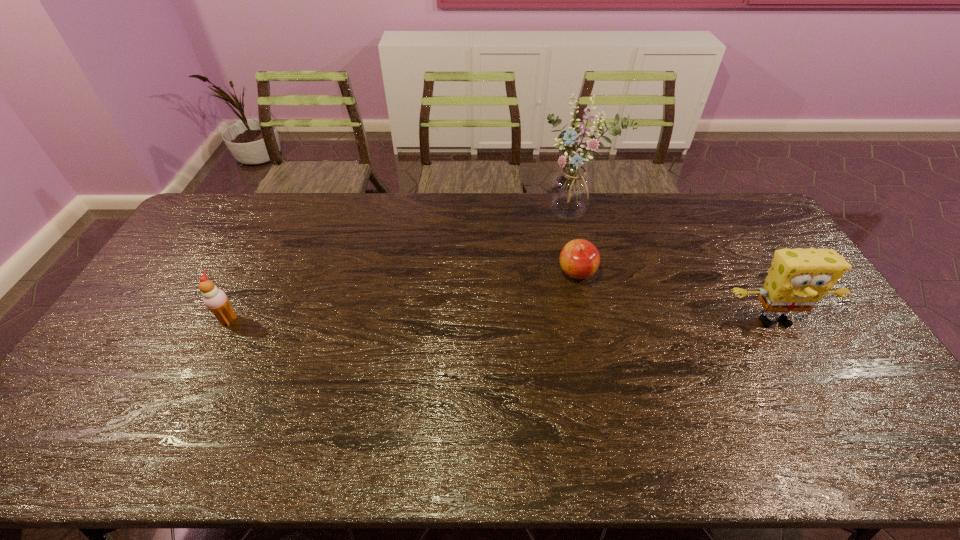
Where is `free space located 0.230m on the front-facing side of the tallest object`? The image size is (960, 540). free space located 0.230m on the front-facing side of the tallest object is located at coordinates (567, 274).

Image resolution: width=960 pixels, height=540 pixels. Identify the location of free space located on the front-facing side of the tallest object. (566, 287).

The width and height of the screenshot is (960, 540). Find the location of `free space located on the front-facing side of the tallest object`. free space located on the front-facing side of the tallest object is located at coordinates (567, 269).

Locate an element on the screen. vacant space located 0.190m on the stem of the third nearest object is located at coordinates (562, 332).

In order to click on vacant space situated on the stem of the third nearest object in this screenshot , I will do `click(568, 305)`.

You are a GUI agent. You are given a task and a screenshot of the screen. Output one action in this format:
    pyautogui.click(x=<x>, y=<y>)
    Task: Click on the free space located 0.080m on the stem of the third nearest object
    This screenshot has width=960, height=540.
    Given the screenshot: What is the action you would take?
    (568, 305)

Identify the location of object situated at the far edge. Image resolution: width=960 pixels, height=540 pixels. (570, 190).

This screenshot has width=960, height=540. I want to click on object at the right edge, so click(798, 278).

Find the location of a particular element. Image resolution: width=960 pixels, height=540 pixels. vacant space at the far edge of the desktop is located at coordinates (469, 233).

In the image, there is a desktop. Identify the location of vacant region at the near edge. This screenshot has height=540, width=960. (149, 389).